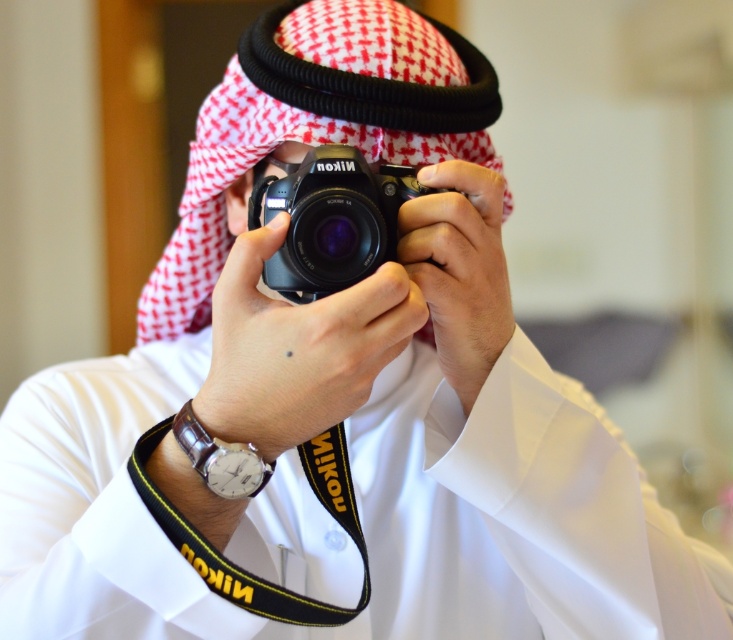
Question: From the image, what is the correct spatial relationship of black matte nikon camera at center in relation to leather watch at lower left?

Choices:
 (A) below
 (B) above

Answer: (B)

Question: Can you confirm if black matte nikon camera at center is thinner than leather watch at lower left?

Choices:
 (A) no
 (B) yes

Answer: (A)

Question: Which of the following is the farthest from the observer?

Choices:
 (A) black matte nikon camera at center
 (B) leather watch at lower left

Answer: (A)

Question: Does black matte nikon camera at center appear under leather watch at lower left?

Choices:
 (A) yes
 (B) no

Answer: (B)